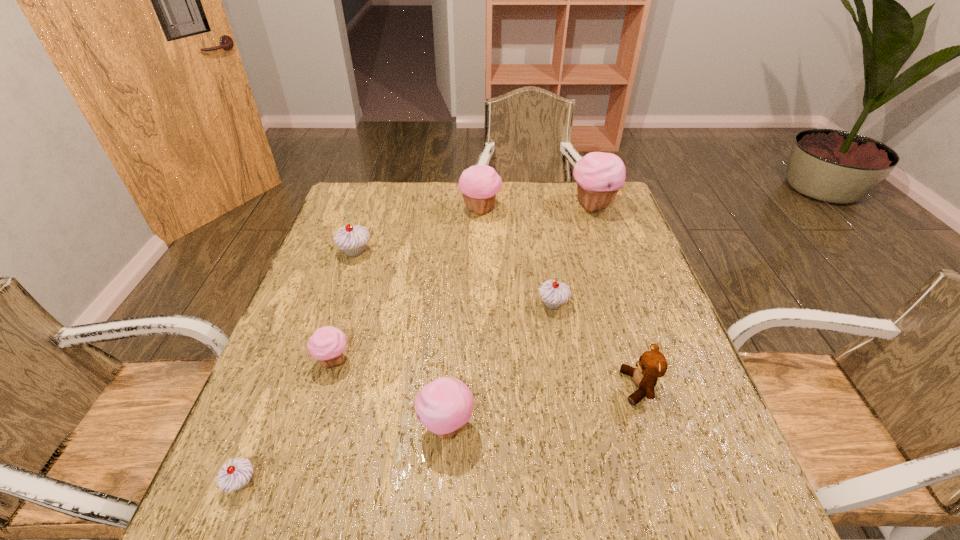
At what (x,y) coordinates should I click in order to perform the action: click on the biggest pink cupcake. Please return your answer as a coordinate pair (x, y). This screenshot has height=540, width=960. Looking at the image, I should click on (599, 176).

Find the location of a particular element. the rightmost cupcake is located at coordinates (599, 176).

Locate an element on the screen. The height and width of the screenshot is (540, 960). the second biggest pink cupcake is located at coordinates (479, 184).

The image size is (960, 540). Find the location of `the sixth nearest object`. the sixth nearest object is located at coordinates (352, 239).

Find the location of a particular element. Image resolution: width=960 pixels, height=540 pixels. the farthest gray cupcake is located at coordinates (352, 239).

Where is `the fourth farthest cupcake`? The width and height of the screenshot is (960, 540). the fourth farthest cupcake is located at coordinates (553, 293).

This screenshot has width=960, height=540. In order to click on the sixth object from left to right in this screenshot , I will do `click(553, 293)`.

This screenshot has height=540, width=960. Find the location of `the sixth farthest cupcake`. the sixth farthest cupcake is located at coordinates (443, 406).

In order to click on the nearest pink cupcake in this screenshot , I will do `click(443, 406)`.

You are a GUI agent. You are given a task and a screenshot of the screen. Output one action in this format:
    pyautogui.click(x=<x>, y=<y>)
    Task: Click on the teddy bear
    
    Given the screenshot: What is the action you would take?
    (652, 365)